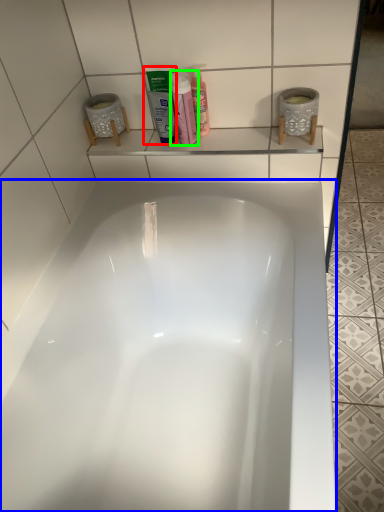
Question: Based on their relative distances, which object is farther from mouthwash (highlighted by a red box)? Choose from bathtub (highlighted by a blue box) and cleaning product (highlighted by a green box).

Choices:
 (A) bathtub
 (B) cleaning product

Answer: (A)